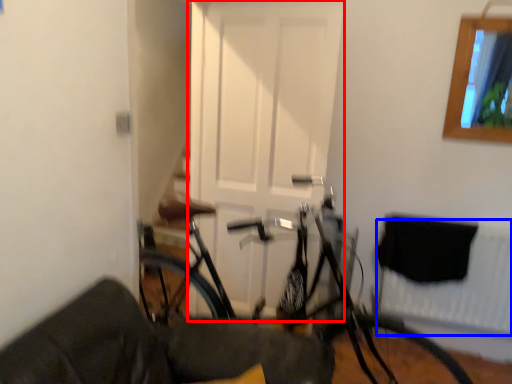
Question: Which point is further to the camera, door (highlighted by a red box) or radiator (highlighted by a blue box)?

Choices:
 (A) door
 (B) radiator

Answer: (B)